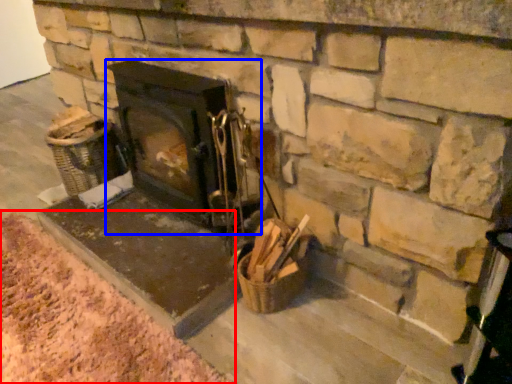
Question: Which of the following is the farthest to the observer, debris (highlighted by a red box) or wood burning stove (highlighted by a blue box)?

Choices:
 (A) debris
 (B) wood burning stove

Answer: (B)